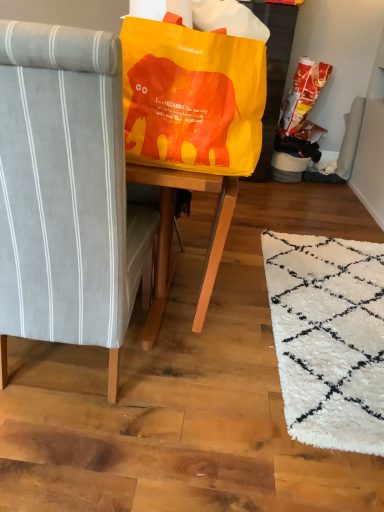
You are a GUI agent. You are given a task and a screenshot of the screen. Output one action in this format:
    pyautogui.click(x=<x>, y=<y>)
    Task: Click on the vacant area that lies to the right of gray fabric chair at left
    
    Given the screenshot: What is the action you would take?
    [197, 366]